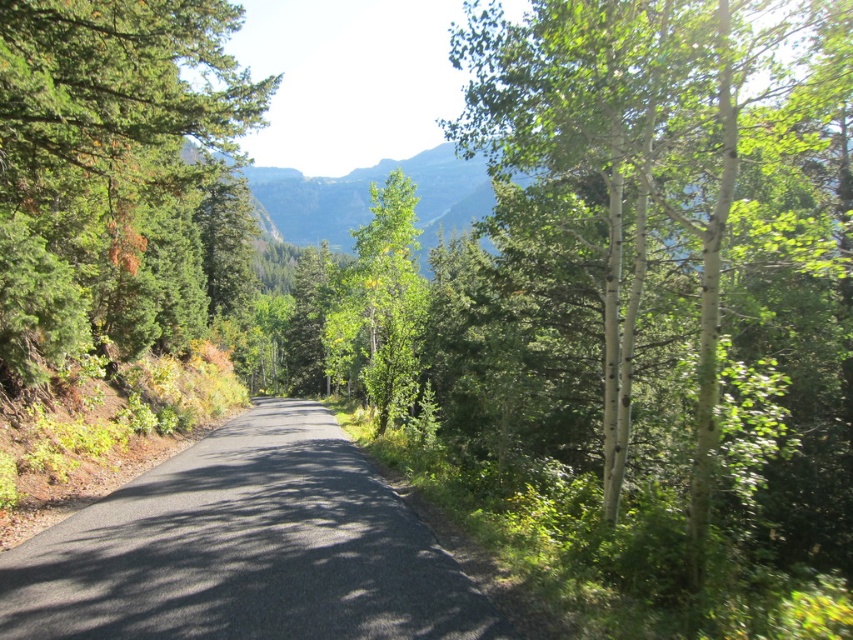
Between green matte tree at left and green leafy tree at center, which one appears on the right side from the viewer's perspective?

green leafy tree at center

Is green matte tree at left smaller than green leafy tree at center?

Incorrect, green matte tree at left is not smaller in size than green leafy tree at center.

Does point (236, 129) come farther from viewer compared to point (413, 369)?

No.

The image size is (853, 640). Find the location of `green matte tree at left`. green matte tree at left is located at coordinates (108, 172).

Is white bark tree at right bigger than green matte tree at left?

Yes.

Who is more distant from viewer, (561,35) or (53,81)?

The point (53,81) is behind.

Is point (618, 28) in front of point (107, 339)?

Yes, point (618, 28) is in front of point (107, 339).

The width and height of the screenshot is (853, 640). Identify the location of white bark tree at right. coord(694,209).

Locate an element on the screen. Image resolution: width=853 pixels, height=640 pixels. white bark tree at right is located at coordinates (694, 209).

Who is more forward, (x=583, y=129) or (x=202, y=528)?

Point (x=583, y=129) is in front.

Locate an element on the screen. white bark tree at right is located at coordinates (694, 209).